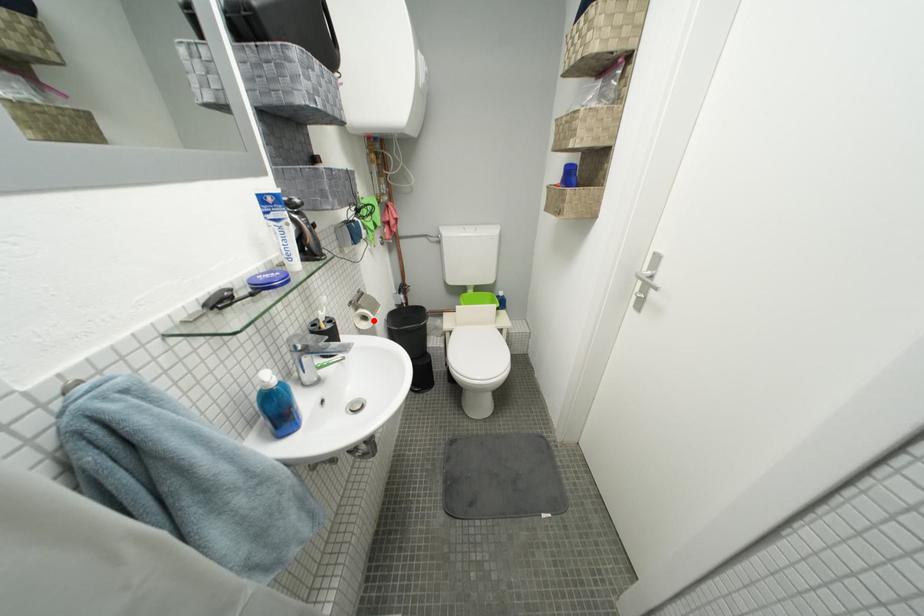
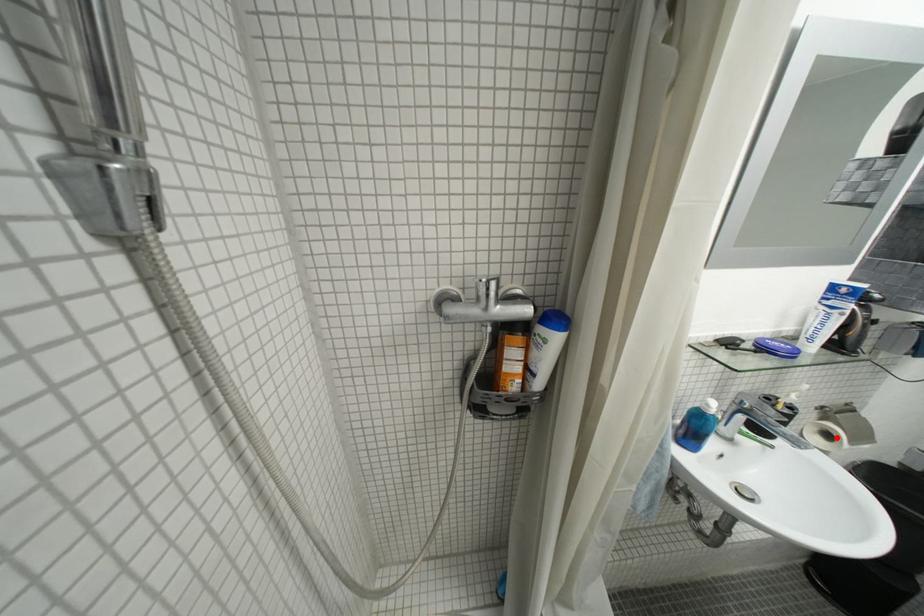
From the picture: I am providing you with two images of the same scene from different viewpoints. A red point is marked on the first image and another point is marked on the second image. Is the marked point in image1 the same physical position as the marked point in image2?

Yes